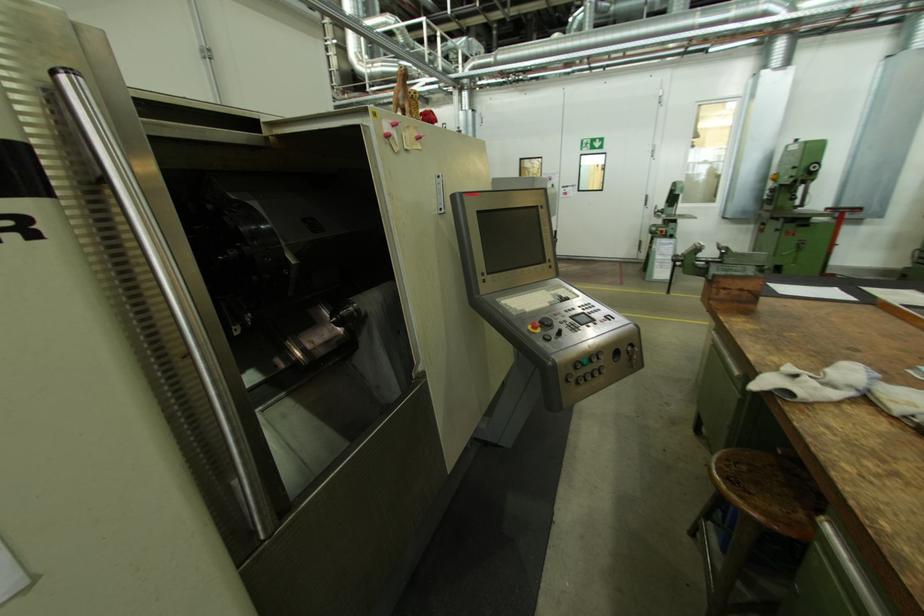
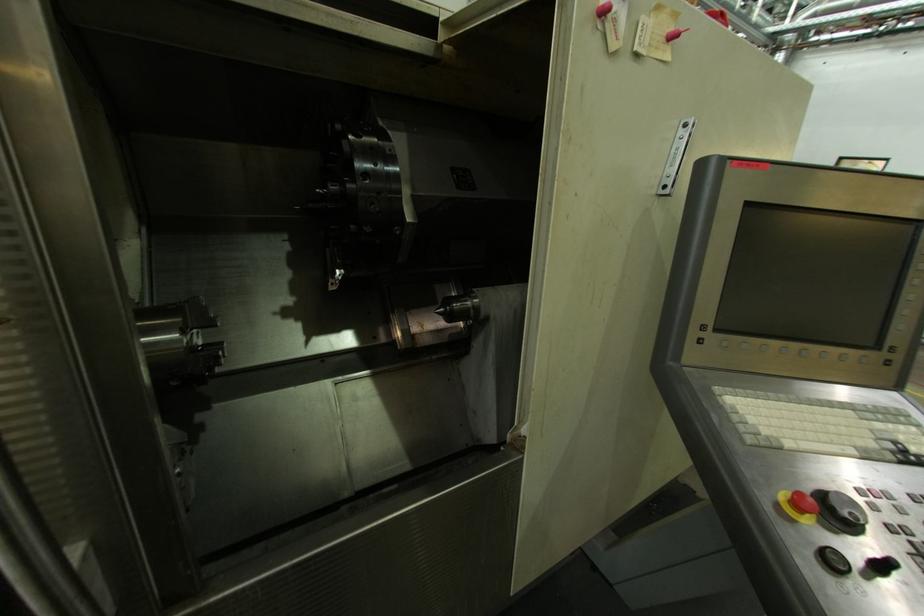
In the second image, find the point that corresponds to point 339,320 in the first image.

(448, 310)